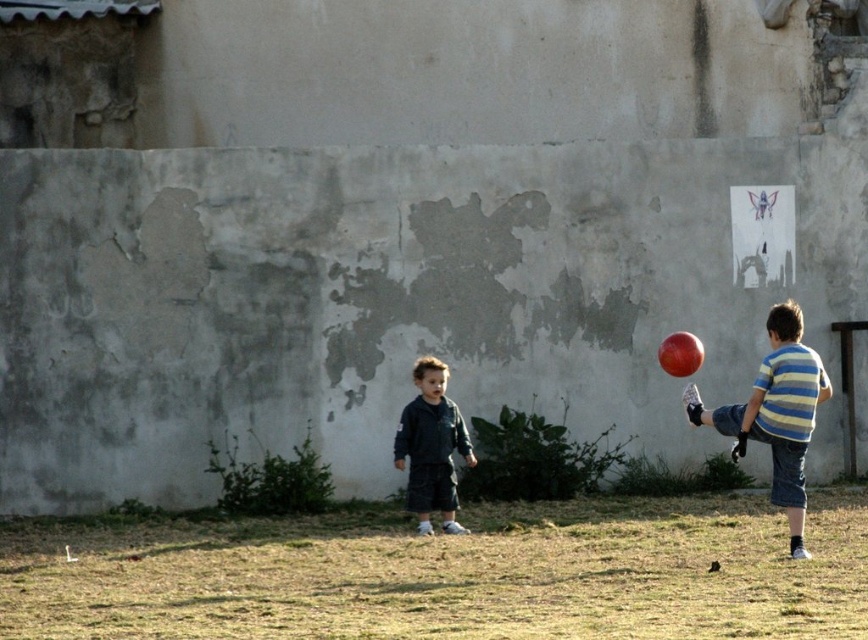
Can you confirm if striped cotton shirt at right is shorter than dark blue denim jacket at center?

In fact, striped cotton shirt at right may be taller than dark blue denim jacket at center.

Describe the element at coordinates (776, 413) in the screenshot. I see `striped cotton shirt at right` at that location.

Who is more forward, (767, 401) or (413, 438)?

Positioned in front is point (767, 401).

The image size is (868, 640). What are the coordinates of `striped cotton shirt at right` in the screenshot? It's located at (776, 413).